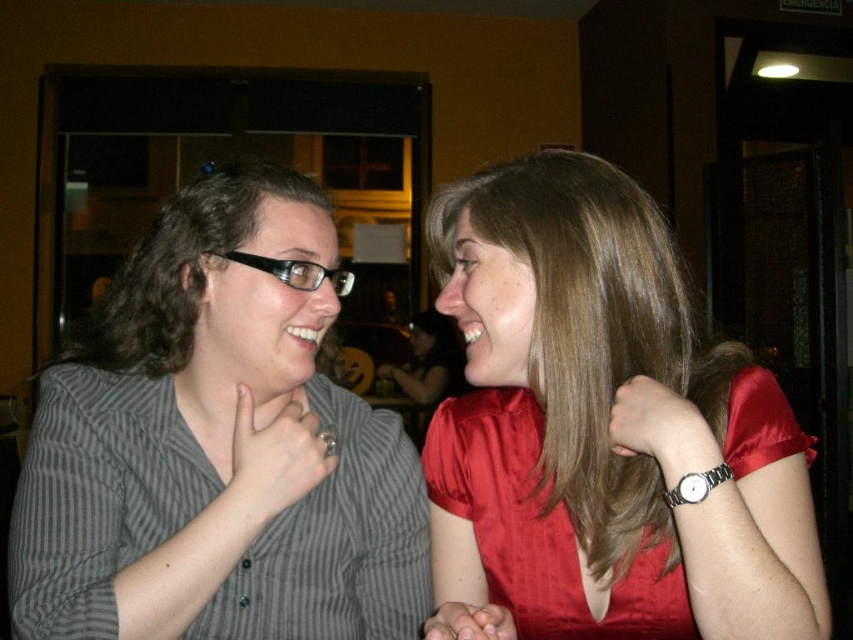
Question: Does striped fabric shirt at left appear over satin red dress at right?

Choices:
 (A) no
 (B) yes

Answer: (B)

Question: Is striped fabric shirt at left above satin red dress at right?

Choices:
 (A) no
 (B) yes

Answer: (B)

Question: Where is striped fabric shirt at left located in relation to satin red dress at right in the image?

Choices:
 (A) below
 (B) above

Answer: (B)

Question: Which point appears farthest from the camera in this image?

Choices:
 (A) (792, 436)
 (B) (189, 205)

Answer: (B)

Question: Which object appears closest to the camera in this image?

Choices:
 (A) striped fabric shirt at left
 (B) satin red dress at right

Answer: (B)

Question: Which of the following is the farthest from the observer?

Choices:
 (A) striped fabric shirt at left
 (B) satin red dress at right

Answer: (A)